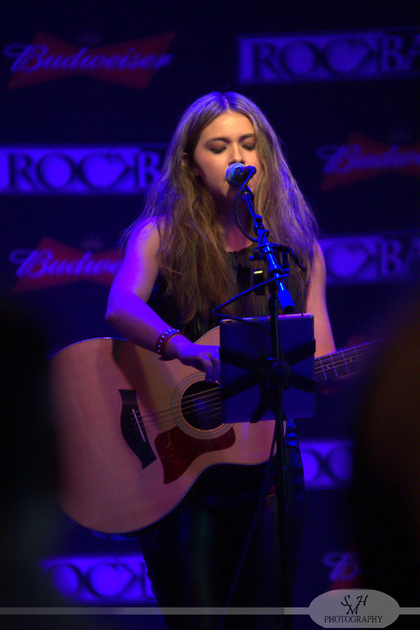
The height and width of the screenshot is (630, 420). I want to click on stand, so click(235, 353).